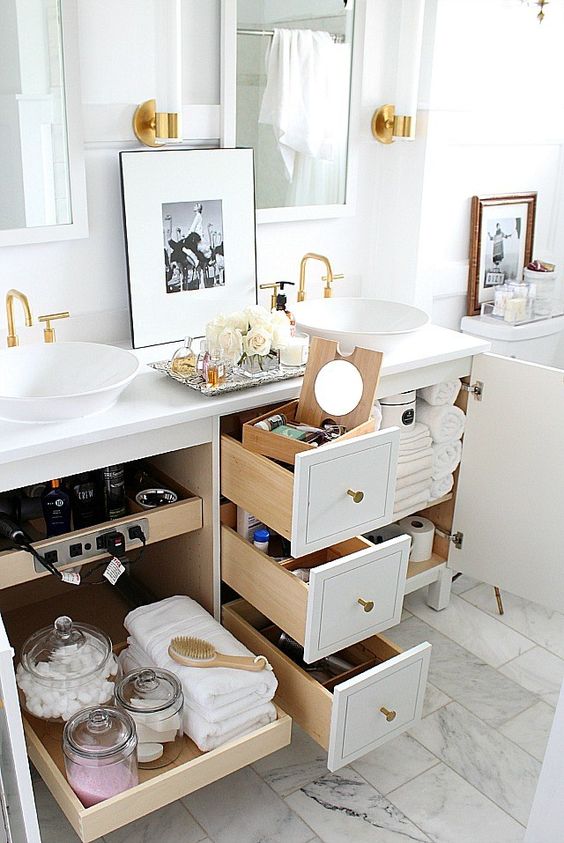
This screenshot has width=564, height=843. Identify the location of gray marbled floor. (473, 717).